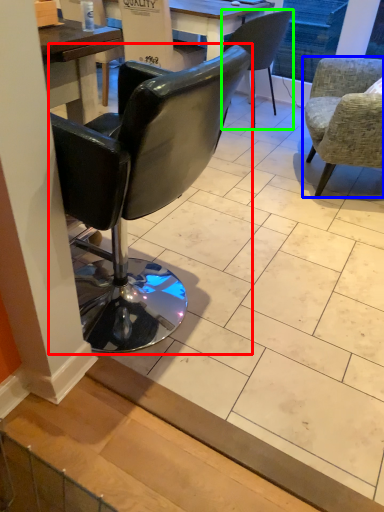
Question: Estimate the real-world distances between objects in this image. Which object is closer to chair (highlighted by a red box), chair (highlighted by a blue box) or chair (highlighted by a green box)?

Choices:
 (A) chair
 (B) chair

Answer: (A)